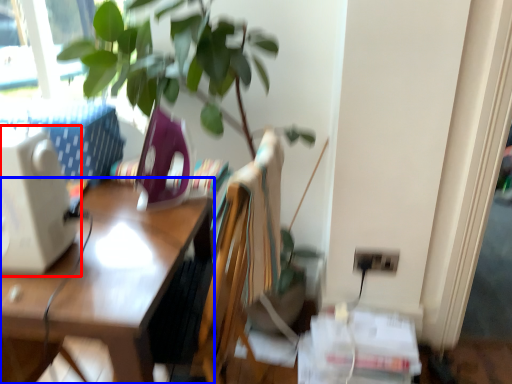
Question: Which object appears closest to the camera in this image, desktop computer (highlighted by a red box) or desk (highlighted by a blue box)?

Choices:
 (A) desktop computer
 (B) desk

Answer: (B)